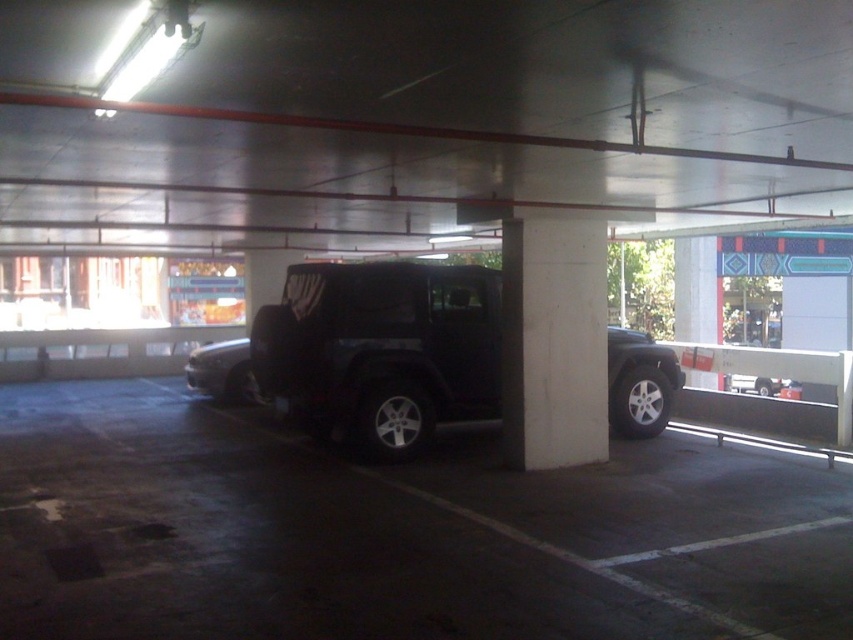
Question: Is black rubber tire at center below matte black suv at center?

Choices:
 (A) yes
 (B) no

Answer: (A)

Question: Which of the following is the farthest from the observer?

Choices:
 (A) (212, 346)
 (B) (260, 480)
 (C) (332, 360)

Answer: (A)

Question: Which is nearer to the black rubber tire at center?

Choices:
 (A) matte black jeep at center
 (B) matte black suv at center

Answer: (A)

Question: Is black rubber tire at center above matte black suv at center?

Choices:
 (A) yes
 (B) no

Answer: (B)

Question: Which point is farther to the camera?

Choices:
 (A) (235, 346)
 (B) (381, 445)

Answer: (A)

Question: Can you confirm if black rubber tire at center is positioned to the right of matte black suv at center?

Choices:
 (A) yes
 (B) no

Answer: (A)